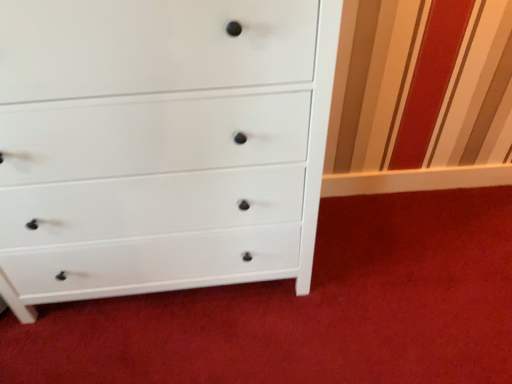
You are a GUI agent. You are given a task and a screenshot of the screen. Output one action in this format:
    pyautogui.click(x=<x>, y=<y>)
    Task: Click on the white wood dresser at lower left
    
    Given the screenshot: What is the action you would take?
    pyautogui.click(x=310, y=309)

The width and height of the screenshot is (512, 384). What do you see at coordinates (310, 309) in the screenshot? I see `white wood dresser at lower left` at bounding box center [310, 309].

The height and width of the screenshot is (384, 512). I want to click on white wood dresser at lower left, so click(x=310, y=309).